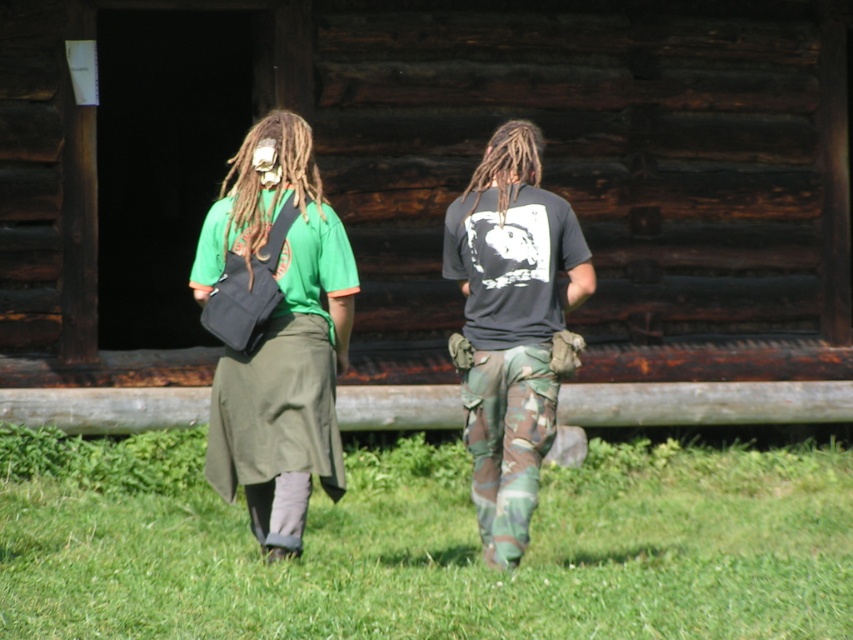
Can you confirm if green fabric skirt at center is positioned to the left of dreadlocks at center?

Indeed, green fabric skirt at center is positioned on the left side of dreadlocks at center.

Who is lower down, green fabric skirt at center or dreadlocks at center?

green fabric skirt at center is lower down.

Who is more forward, (523, 284) or (538, 141)?

Point (523, 284) is more forward.

Where is `green fabric skirt at center`? This screenshot has height=640, width=853. green fabric skirt at center is located at coordinates (276, 332).

Can you confirm if green grass at lower center is wider than dark gray matte t-shirt at center?

Yes.

Does green grass at lower center have a lesser height compared to dark gray matte t-shirt at center?

Correct, green grass at lower center is not as tall as dark gray matte t-shirt at center.

Image resolution: width=853 pixels, height=640 pixels. Find the location of `green grass at lower center`. green grass at lower center is located at coordinates (425, 545).

Is green fabric skirt at center in front of brown/dry/dreadlocks at center?

That is True.

Is point (511, 396) in front of point (256, 184)?

That is True.

Image resolution: width=853 pixels, height=640 pixels. What are the coordinates of `green fabric skirt at center` in the screenshot? It's located at (276, 332).